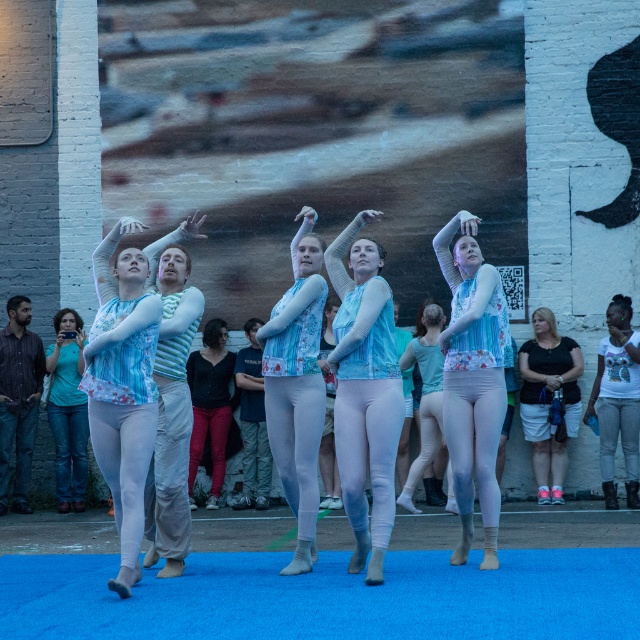
Can you confirm if matte blue leotard at center is shorter than black jersey at center?

In fact, matte blue leotard at center may be taller than black jersey at center.

Which of these two, matte blue leotard at center or black jersey at center, stands shorter?

With less height is black jersey at center.

Who is more forward, [465,324] or [189,360]?

Point [465,324] is in front.

The width and height of the screenshot is (640, 640). Find the location of `matte blue leotard at center`. matte blue leotard at center is located at coordinates (472, 378).

Does light blue fabric dress at center appear over pink fabric shorts at right?

Correct, light blue fabric dress at center is located above pink fabric shorts at right.

Can you confirm if light blue fabric dress at center is wider than pink fabric shorts at right?

No, light blue fabric dress at center is not wider than pink fabric shorts at right.

Who is more forward, [348,317] or [548,380]?

Point [348,317] is in front.

Where is `light blue fabric dress at center`? This screenshot has height=640, width=640. light blue fabric dress at center is located at coordinates pos(364,392).

Does light blue fabric dress at center appear on the left side of denim pants at center?

No, light blue fabric dress at center is not to the left of denim pants at center.

Can you confirm if light blue fabric dress at center is wider than denim pants at center?

Correct, the width of light blue fabric dress at center exceeds that of denim pants at center.

Identify the location of light blue fabric dress at center. (364, 392).